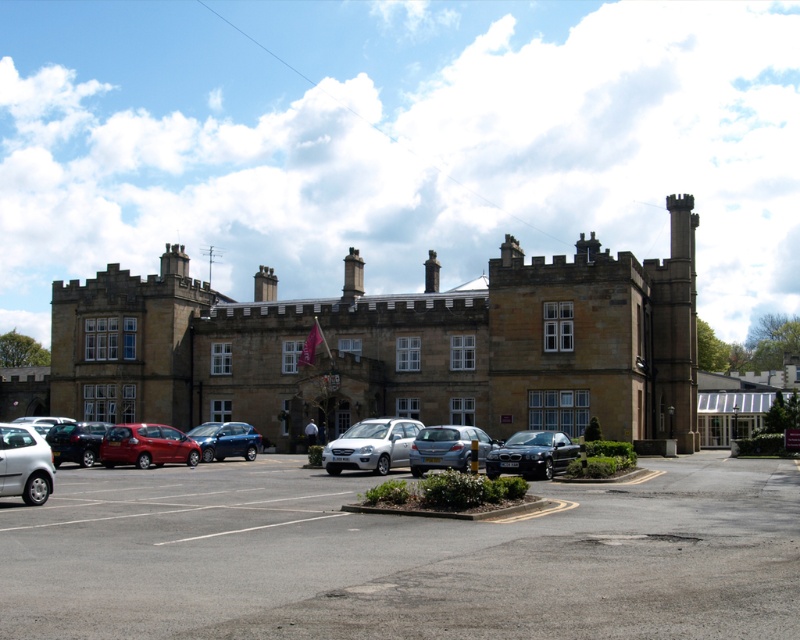
Question: Is brown stone building at center above satin silver car at center?

Choices:
 (A) yes
 (B) no

Answer: (A)

Question: From the image, what is the correct spatial relationship of gray asphalt parking lot at center in relation to satin silver sedan at center?

Choices:
 (A) left
 (B) right

Answer: (B)

Question: Which point is farther to the camera?

Choices:
 (A) (776, 372)
 (B) (564, 461)
 (C) (325, 461)
 (D) (56, 440)

Answer: (A)

Question: Considering the real-world distances, which object is closest to the brown stone building at center?

Choices:
 (A) silver metallic hatchback at lower left
 (B) white glass building at right

Answer: (B)

Question: Which point is closer to the camera taking this photo?

Choices:
 (A) (741, 420)
 (B) (352, 433)
 (C) (204, 428)

Answer: (B)

Question: Is gray asphalt parking lot at center thinner than brown stone building at center?

Choices:
 (A) yes
 (B) no

Answer: (A)